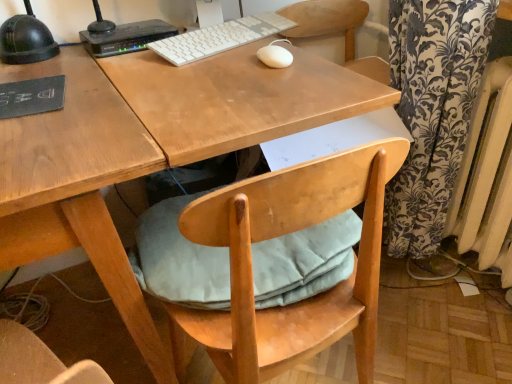
Measure the distance between point (495,152) and camera.

1.10 meters.

Describe the element at coordinates (122, 35) in the screenshot. The image size is (512, 384). I see `black plastic router at upper left` at that location.

Image resolution: width=512 pixels, height=384 pixels. What are the coordinates of `white plastic keyboard at upper center` in the screenshot? It's located at (219, 38).

Locate an element on the screen. light blue fabric cushion at under desk is located at coordinates (277, 236).

Image resolution: width=512 pixels, height=384 pixels. What are the coordinates of `white painted metal radiator at right` in the screenshot? It's located at (487, 177).

Could you tell me if white painted metal radiator at right is facing black plastic router at upper left?

No.

Between point (486, 138) and point (93, 42), which one is positioned in front?

Positioned in front is point (93, 42).

From a real-world perspective, who is located lower, white painted metal radiator at right or black plastic router at upper left?

From a 3D spatial view, white painted metal radiator at right is below.

Could you tell me if white matte mouse at center is turned towards white painted metal radiator at right?

No, white matte mouse at center is not facing towards white painted metal radiator at right.

In the scene shown: Can you tell me how much white matte mouse at center and white painted metal radiator at right differ in facing direction?

The facing directions of white matte mouse at center and white painted metal radiator at right are 87.1 degrees apart.

From a real-world perspective, does white matte mouse at center sit lower than white painted metal radiator at right?

No, from a real-world perspective, white matte mouse at center is not beneath white painted metal radiator at right.

From the image's perspective, is white matte mouse at center above or below white painted metal radiator at right?

white matte mouse at center is above white painted metal radiator at right.

Is black plastic router at upper left thinner than light blue fabric cushion at under desk?

Yes, black plastic router at upper left is thinner than light blue fabric cushion at under desk.

From a real-world perspective, relative to light blue fabric cushion at under desk, is black plastic router at upper left vertically above or below?

In terms of real-world spatial position, black plastic router at upper left is above light blue fabric cushion at under desk.

From the image's perspective, is black plastic router at upper left positioned above or below light blue fabric cushion at under desk?

Clearly, from the image's perspective, black plastic router at upper left is above light blue fabric cushion at under desk.

How different are the orientations of black plastic router at upper left and light blue fabric cushion at under desk in degrees?

The angle between the facing direction of black plastic router at upper left and the facing direction of light blue fabric cushion at under desk is 176 degrees.

Is light blue fabric cushion at under desk bigger or smaller than white plastic keyboard at upper center?

Clearly, light blue fabric cushion at under desk is larger in size than white plastic keyboard at upper center.

The width and height of the screenshot is (512, 384). Identify the location of chair that is below the white plastic keyboard at upper center (from the image's perspective). (277, 236).

Is light blue fabric cushion at under desk in front of white plastic keyboard at upper center?

Yes, it is.

Is light blue fabric cushion at under desk turned away from white plastic keyboard at upper center?

light blue fabric cushion at under desk does not have its back to white plastic keyboard at upper center.

Considering the relative sizes of black plastic router at upper left and white matte mouse at center in the image provided, is black plastic router at upper left smaller than white matte mouse at center?

Actually, black plastic router at upper left might be larger than white matte mouse at center.

Identify the location of mouse located in front of the black plastic router at upper left. (275, 56).

Is black plastic router at upper left far from white matte mouse at center?

No, there isn't a large distance between black plastic router at upper left and white matte mouse at center.

Which of these two, black plastic router at upper left or white matte mouse at center, stands shorter?

Standing shorter between the two is white matte mouse at center.

Which object is further away from the camera, light blue fabric cushion at under desk or white matte mouse at center?

white matte mouse at center.

At what (x,y) coordinates should I click in order to perform the action: click on chair below the white matte mouse at center (from a real-world perspective). Please return your answer as a coordinate pair (x, y). The width and height of the screenshot is (512, 384). Looking at the image, I should click on (277, 236).

Which is more to the right, light blue fabric cushion at under desk or white matte mouse at center?

From the viewer's perspective, white matte mouse at center appears more on the right side.

Which is behind, point (85, 42) or point (494, 263)?

Point (494, 263)

Can you confirm if black plastic router at upper left is taller than white painted metal radiator at right?

No, black plastic router at upper left is not taller than white painted metal radiator at right.

The height and width of the screenshot is (384, 512). In the image, there is a black plastic router at upper left. Identify the location of radiator below it (from the image's perspective). (487, 177).

Where is `radiator below the black plastic router at upper left (from the image's perspective)`? The height and width of the screenshot is (384, 512). radiator below the black plastic router at upper left (from the image's perspective) is located at coordinates (487, 177).

Find the location of a particular element. The image size is (512, 384). radiator that is under the white matte mouse at center (from a real-world perspective) is located at coordinates (487, 177).

Looking at the image, which one is located closer to black plastic router at upper left, white matte mouse at center or white plastic keyboard at upper center?

white plastic keyboard at upper center is closer to black plastic router at upper left.

From the image, which object appears to be nearer to white painted metal radiator at right, white plastic keyboard at upper center or light blue fabric cushion at under desk?

The object closer to white painted metal radiator at right is light blue fabric cushion at under desk.

From the image, which object appears to be nearer to black plastic router at upper left, light blue fabric cushion at under desk or white painted metal radiator at right?

Based on the image, light blue fabric cushion at under desk appears to be nearer to black plastic router at upper left.

Estimate the real-world distances between objects in this image. Which object is closer to light blue fabric cushion at under desk, black plastic router at upper left or white painted metal radiator at right?

white painted metal radiator at right lies closer to light blue fabric cushion at under desk than the other object.

When comparing their distances from white matte mouse at center, does black plastic router at upper left or light blue fabric cushion at under desk seem further?

Among the two, light blue fabric cushion at under desk is located further to white matte mouse at center.

Considering their positions, is white matte mouse at center positioned further to white plastic keyboard at upper center than white painted metal radiator at right?

white painted metal radiator at right lies further to white plastic keyboard at upper center than the other object.

Based on their spatial positions, is white painted metal radiator at right or light blue fabric cushion at under desk further from black plastic router at upper left?

white painted metal radiator at right is positioned further to the anchor black plastic router at upper left.

Estimate the real-world distances between objects in this image. Which object is closer to white matte mouse at center, white plastic keyboard at upper center or black plastic router at upper left?

white plastic keyboard at upper center is positioned closer to the anchor white matte mouse at center.

The image size is (512, 384). Find the location of `mouse between black plastic router at upper left and white painted metal radiator at right from left to right`. mouse between black plastic router at upper left and white painted metal radiator at right from left to right is located at coordinates (275, 56).

In order to click on computer keyboard between black plastic router at upper left and white painted metal radiator at right from left to right in this screenshot , I will do `click(219, 38)`.

I want to click on chair situated between black plastic router at upper left and white painted metal radiator at right from left to right, so click(x=277, y=236).

At what (x,y) coordinates should I click in order to perform the action: click on mouse between white plastic keyboard at upper center and light blue fabric cushion at under desk in the vertical direction. Please return your answer as a coordinate pair (x, y). Looking at the image, I should click on (275, 56).